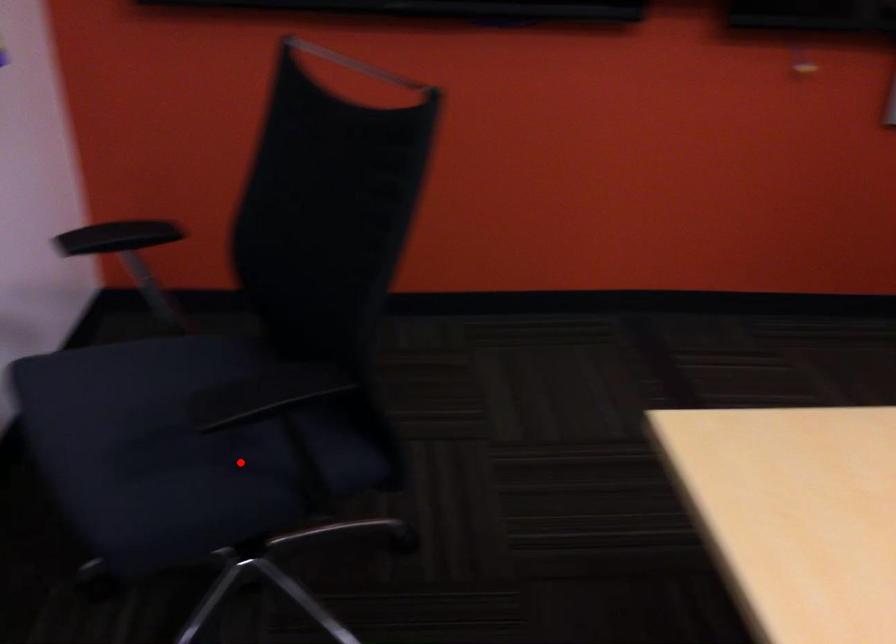
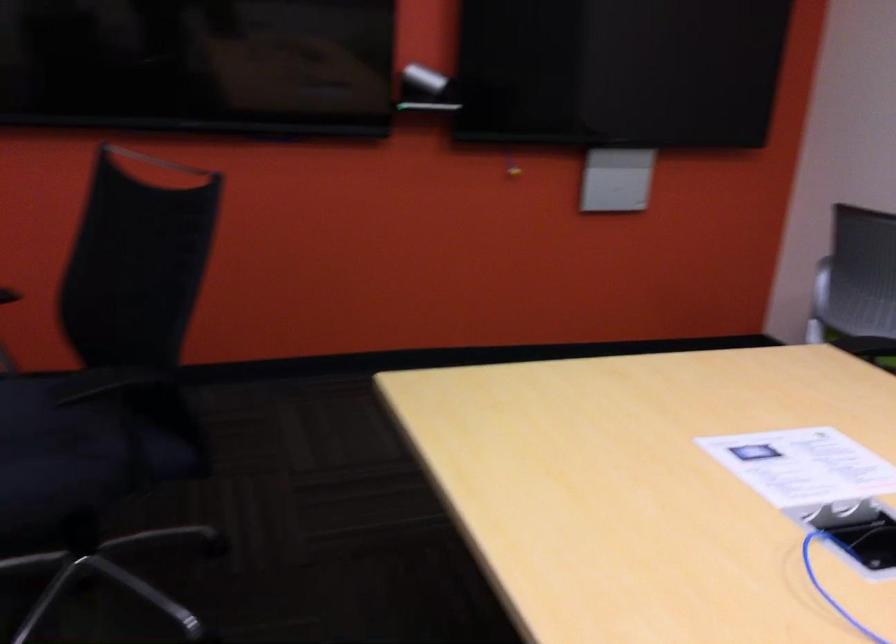
Question: I am providing you with two images of the same scene from different viewpoints. A red point is shown in image1. For the corresponding object point in image2, is it positioned nearer or farther from the camera?

Choices:
 (A) Nearer
 (B) Farther

Answer: (B)